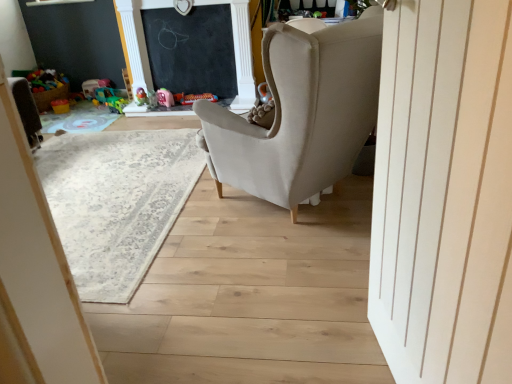
Image resolution: width=512 pixels, height=384 pixels. Identify the location of vacant region in front of matte orange toy at center, placed as the sixth toy when sorted from right to left. (60, 112).